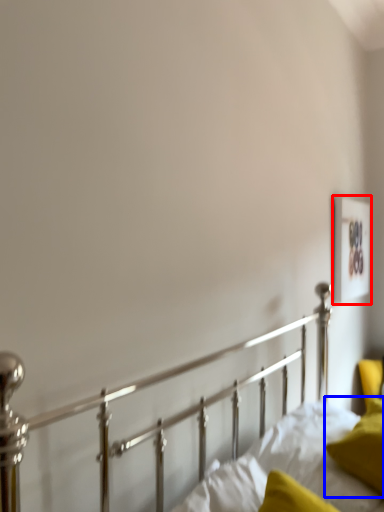
Question: Among these objects, which one is farthest to the camera, picture frame (highlighted by a red box) or pillow (highlighted by a blue box)?

Choices:
 (A) picture frame
 (B) pillow

Answer: (A)